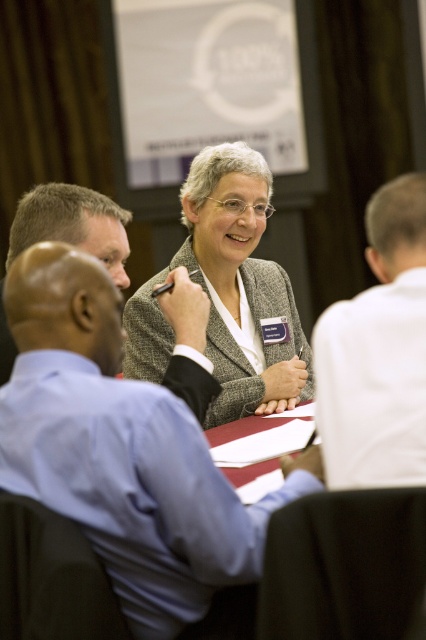
Based on the coordinates provided, which object in the scene is located at point (x=241, y=285)?

The textured gray blazer at center is located at point (x=241, y=285).

You are attending a meeting and need to pass a document to the person wearing the textured gray blazer at center. Based on their position, which direction should you approach from?

The textured gray blazer at center is located at point (241, 285), so you should approach from the front to reach them directly.